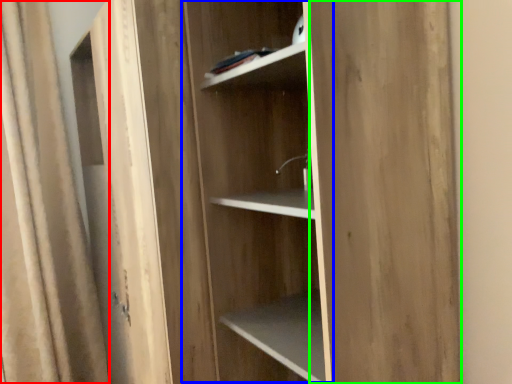
Question: Estimate the real-world distances between objects in this image. Which object is farther from curtain (highlighted by a red box), cabinetry (highlighted by a blue box) or plywood (highlighted by a green box)?

Choices:
 (A) cabinetry
 (B) plywood

Answer: (B)